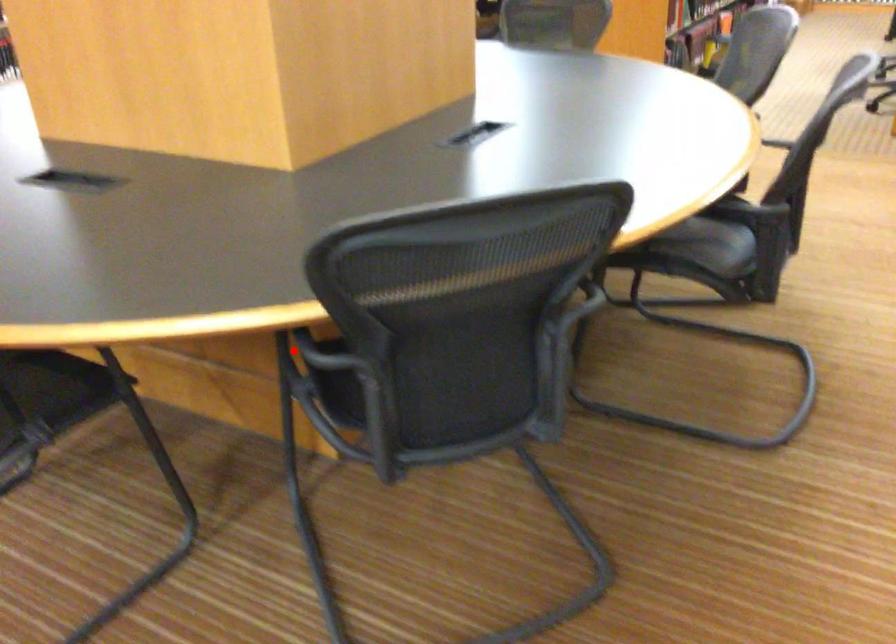
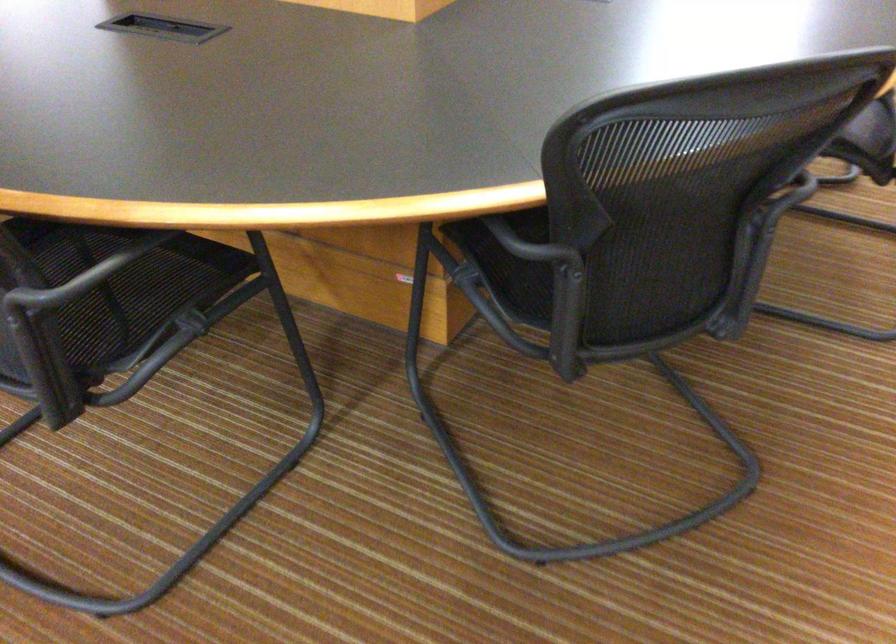
The point at the highlighted location is marked in the first image. Where is the corresponding point in the second image?

(507, 236)